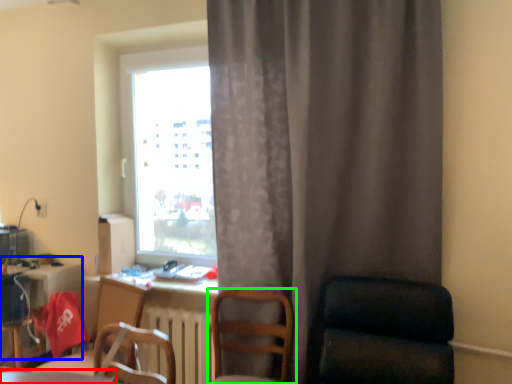
Question: Which object is positioned farthest from table (highlighted by a red box)? Select from computer desk (highlighted by a blue box) and chair (highlighted by a green box).

Choices:
 (A) computer desk
 (B) chair

Answer: (A)